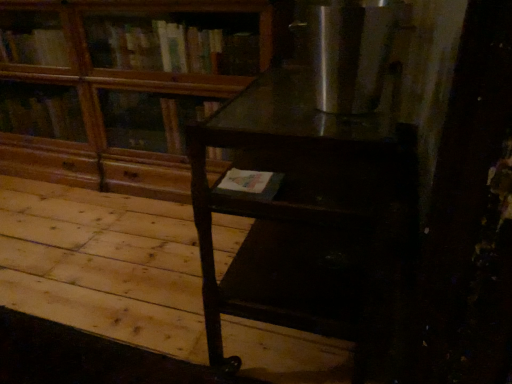
Question: From the image's perspective, is dark wood table at center located above or below wooden at upper left?

Choices:
 (A) below
 (B) above

Answer: (A)

Question: Considering their positions, is dark wood table at center located in front of or behind wooden at upper left?

Choices:
 (A) behind
 (B) front

Answer: (B)

Question: Estimate the real-world distances between objects in this image. Which object is closer to the wooden at upper left?

Choices:
 (A) stainless steel refrigerator at upper right
 (B) dark wood table at center
 (C) dark wood table at center

Answer: (C)

Question: Which object is the farthest from the dark wood table at center?

Choices:
 (A) wooden at upper left
 (B) dark wood table at center
 (C) stainless steel refrigerator at upper right

Answer: (C)